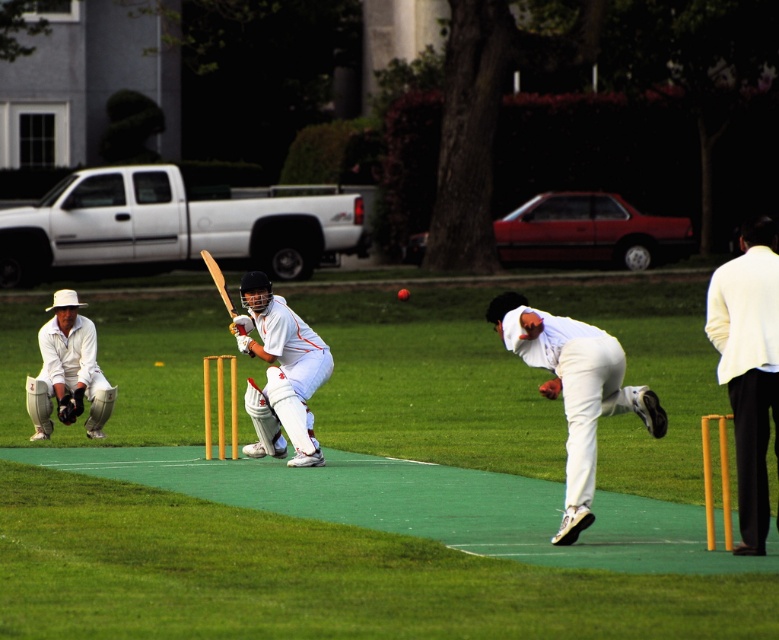
You are a spectator at the cricket match and want to know if the white cloth jacket at upper right can fit into a bag that can only hold items narrower than the white matte cricket bat at center. Can it fit?

The white cloth jacket at upper right is narrower than the white matte cricket bat at center, so it can fit into the bag.

You are a spectator at the cricket match and want to take a photo of both the white clothed bowler at center and the white matte cricket bat at center. Which object should you focus on first if you want to capture both in the same frame without moving your camera?

The white clothed bowler at center is located below the white matte cricket bat at center, so you should focus on the white matte cricket bat at center first to ensure both are in the frame.

You are a spectator at the cricket match and want to locate the white cloth jacket at upper right and the white matte cricket bat at center. Based on their positions, which object is positioned more to the east?

The white cloth jacket at upper right is positioned to the right of the white matte cricket bat at center, so it is more to the east.